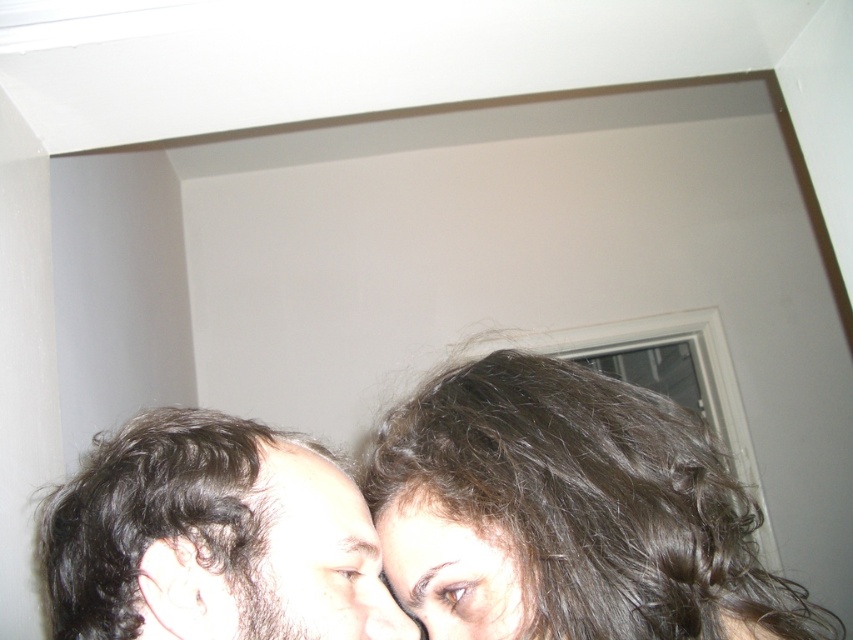
Where is `brown curly hair at center`? brown curly hair at center is located at coordinates (311, 557).

Does brown curly hair at center come behind pale skin at center?

No, it is not.

I want to click on brown curly hair at center, so click(311, 557).

Is dark brown hair at center shorter than matte black nose at center?

Incorrect, dark brown hair at center's height does not fall short of matte black nose at center's.

At what (x,y) coordinates should I click in order to perform the action: click on dark brown hair at center. Please return your answer as a coordinate pair (x, y). The image size is (853, 640). Looking at the image, I should click on (569, 513).

Between point (590, 536) and point (389, 595), which one is positioned in front?

Positioned in front is point (590, 536).

In order to click on dark brown hair at center in this screenshot , I will do `click(569, 513)`.

Measure the distance between dark brown hair at center and brown curly hair at center.

dark brown hair at center and brown curly hair at center are 7.03 inches apart from each other.

Is dark brown hair at center below brown curly hair at center?

Yes, dark brown hair at center is below brown curly hair at center.

Locate an element on the screen. The image size is (853, 640). dark brown hair at center is located at coordinates (569, 513).

Locate an element on the screen. The width and height of the screenshot is (853, 640). dark brown hair at center is located at coordinates (569, 513).